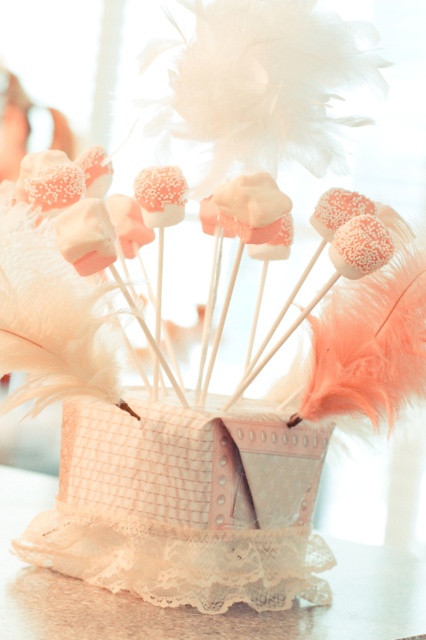
You are a guest at a party and see the coral marshmallow at center and the lace fabric at lower center. Which object is closer to you?

The coral marshmallow at center is closer to you because the lace fabric at lower center is behind it.

Please describe the exact location of the coral marshmallow at center in the image using coordinates. The scene has a vintage container with marshmallow pops. The container is rectangular and light pink with checkered fabric and lace trim. The marshmallow pops are on wooden sticks with white chocolate glaze and colorful sprinkles. You must use the object label exactly as given in the question. Answer with coordinates only.

The coral marshmallow at center is located at coordinates point (62, 312).

You are a guest at a party and see the coral marshmallow at center and the lace fabric at lower center. Which object is positioned higher in the image?

The coral marshmallow at center is located above the lace fabric at lower center, so it is positioned higher.